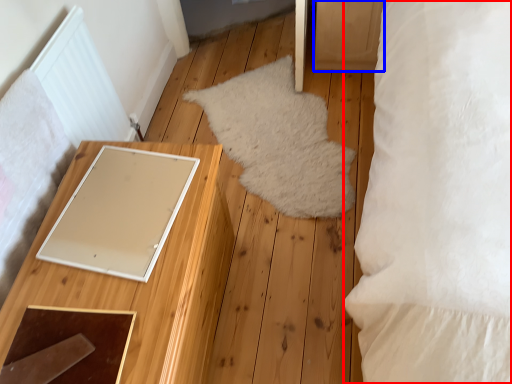
Question: Among these objects, which one is nearest to the camera, pillow (highlighted by a red box) or drawer (highlighted by a blue box)?

Choices:
 (A) pillow
 (B) drawer

Answer: (A)